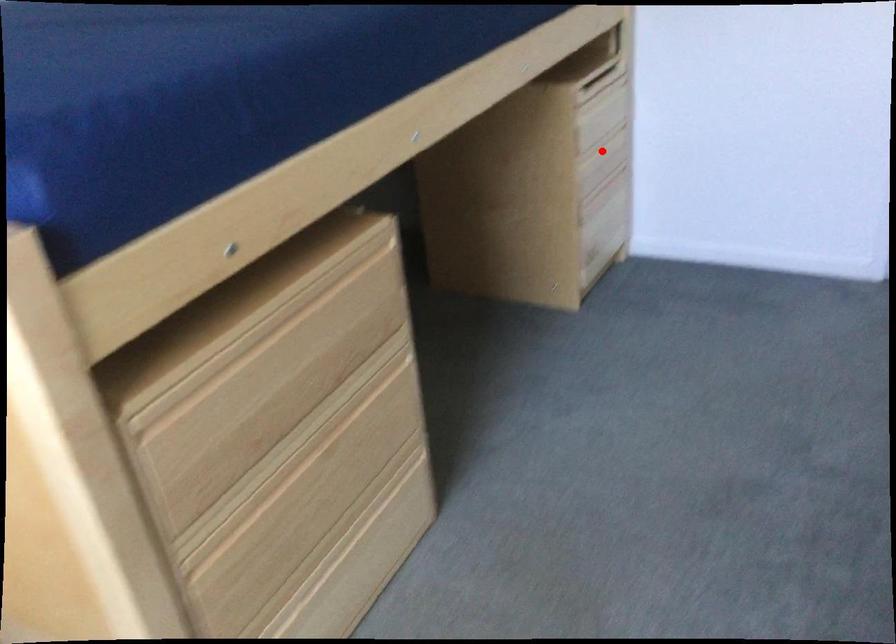
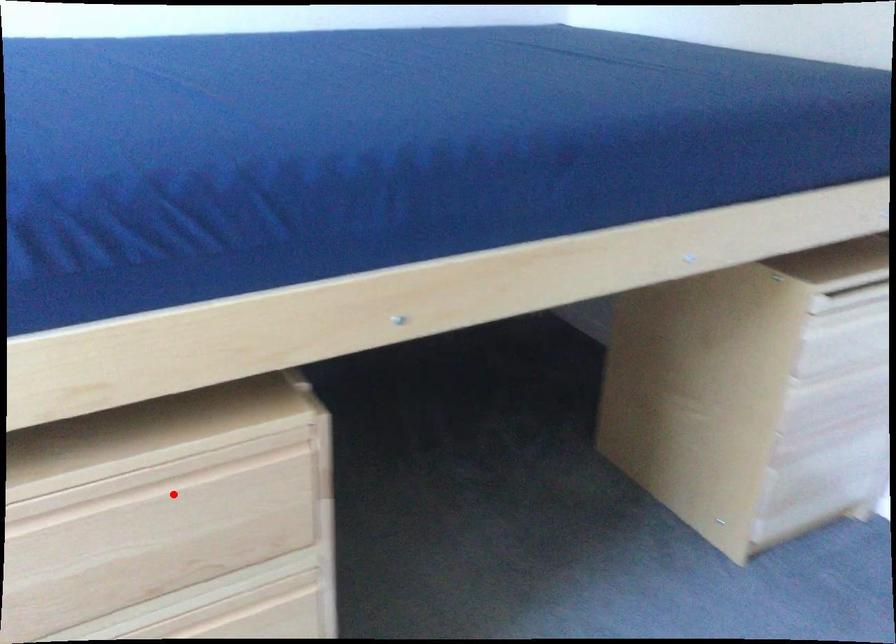
I am providing you with two images of the same scene from different viewpoints. A red point is marked on the first image and another point is marked on the second image. Does the point marked in image1 correspond to the same location as the one in image2?

No